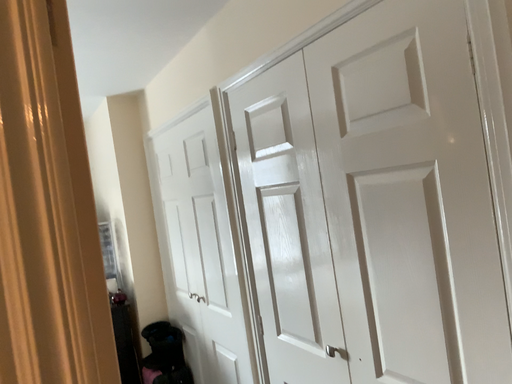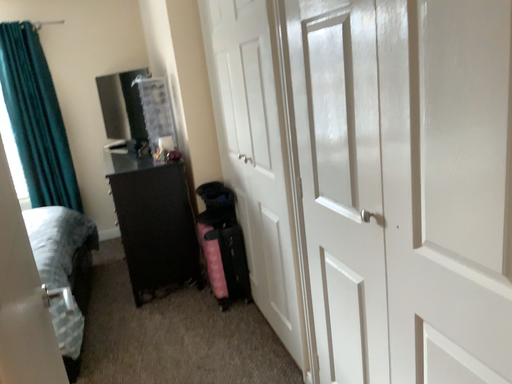
Question: How did the camera likely rotate when shooting the video?

Choices:
 (A) rotated right
 (B) rotated left

Answer: (B)